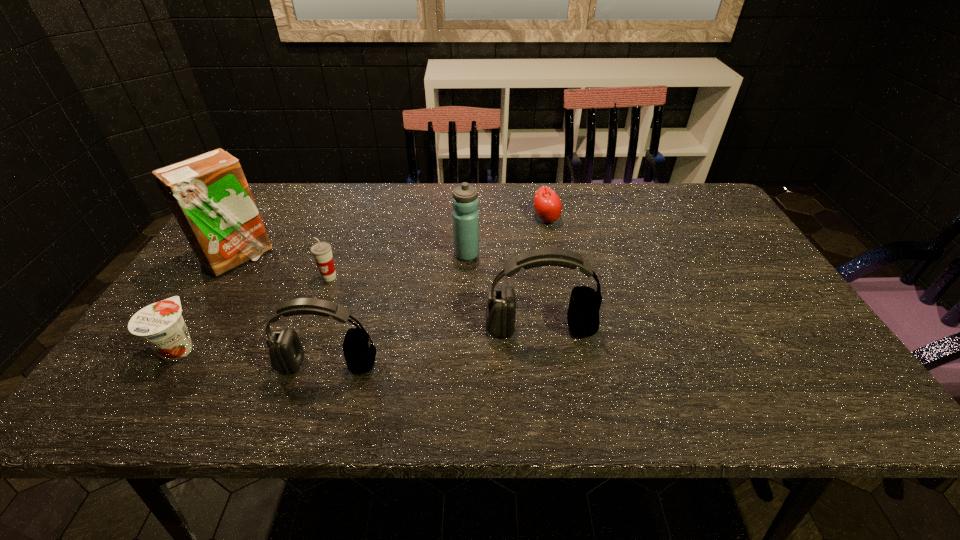
Please show where to add a headset on the right while keeping spacing even. Please provide its 2D coordinates. Your answer should be formatted as a tuple, i.e. [(x, y)], where the tuple contains the x and y coordinates of a point satisfying the conditions above.

[(724, 297)]